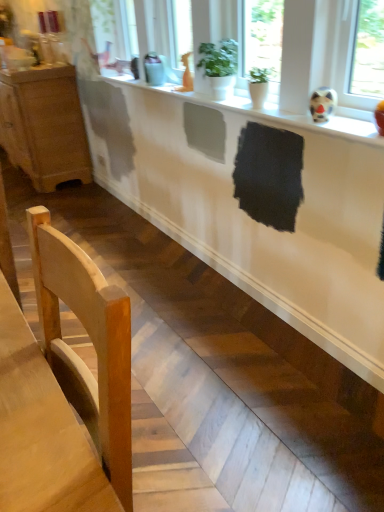
Question: Is wooden cabinet at left oriented away from light wood chair at lower left?

Choices:
 (A) no
 (B) yes

Answer: (A)

Question: From a real-world perspective, is wooden cabinet at left positioned over light wood chair at lower left based on gravity?

Choices:
 (A) no
 (B) yes

Answer: (A)

Question: Is the position of wooden cabinet at left more distant than that of light wood chair at lower left?

Choices:
 (A) yes
 (B) no

Answer: (A)

Question: Are wooden cabinet at left and light wood chair at lower left far apart?

Choices:
 (A) no
 (B) yes

Answer: (B)

Question: From a real-world perspective, is wooden cabinet at left below light wood chair at lower left?

Choices:
 (A) yes
 (B) no

Answer: (A)

Question: Considering their positions, is green matte plant at upper center located in front of or behind white glossy counter at lower center?

Choices:
 (A) front
 (B) behind

Answer: (B)

Question: From their relative heights in the image, would you say green matte plant at upper center is taller or shorter than white glossy counter at lower center?

Choices:
 (A) short
 (B) tall

Answer: (B)

Question: From the image's perspective, relative to white glossy counter at lower center, is green matte plant at upper center above or below?

Choices:
 (A) below
 (B) above

Answer: (B)

Question: From a real-world perspective, is green matte plant at upper center above or below white glossy counter at lower center?

Choices:
 (A) above
 (B) below

Answer: (A)

Question: From the image's perspective, is white glossy counter at lower center above or below light wood chair at lower left?

Choices:
 (A) below
 (B) above

Answer: (B)

Question: Is point (180, 160) positioned closer to the camera than point (31, 209)?

Choices:
 (A) closer
 (B) farther

Answer: (B)

Question: Is white glossy counter at lower center in front of or behind light wood chair at lower left in the image?

Choices:
 (A) front
 (B) behind

Answer: (B)

Question: From their relative heights in the image, would you say white glossy counter at lower center is taller or shorter than light wood chair at lower left?

Choices:
 (A) tall
 (B) short

Answer: (B)

Question: Is wooden cabinet at left situated inside white glossy counter at lower center or outside?

Choices:
 (A) outside
 (B) inside

Answer: (A)

Question: Looking at the image, does wooden cabinet at left seem bigger or smaller compared to white glossy counter at lower center?

Choices:
 (A) big
 (B) small

Answer: (A)